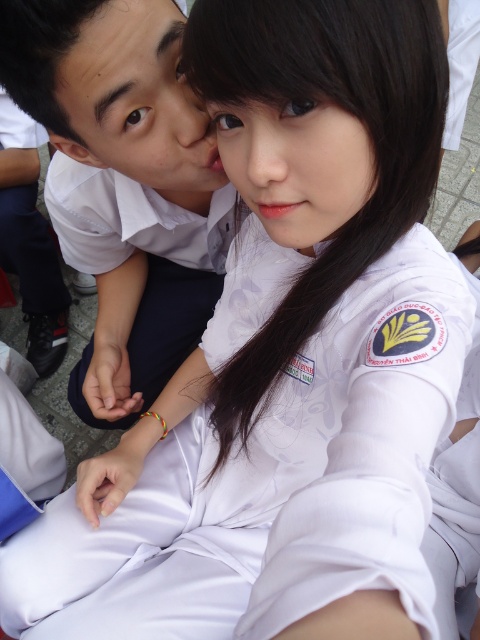
Question: Which of the following is the closest to the observer?

Choices:
 (A) white smooth shirt at upper left
 (B) smooth skin face at center
 (C) matte white face at upper left

Answer: (B)

Question: Estimate the real-world distances between objects in this image. Which object is closer to the smooth skin face at center?

Choices:
 (A) matte white face at upper left
 (B) white smooth shirt at upper left

Answer: (A)

Question: Can you confirm if white smooth shirt at upper left is positioned to the right of smooth skin face at center?

Choices:
 (A) yes
 (B) no

Answer: (B)

Question: Which object is the closest to the matte white face at upper left?

Choices:
 (A) smooth skin face at center
 (B) white smooth shirt at upper left

Answer: (B)

Question: Does white smooth shirt at upper left lie in front of smooth skin face at center?

Choices:
 (A) yes
 (B) no

Answer: (B)

Question: Can you confirm if white smooth shirt at upper left is positioned to the right of matte white face at upper left?

Choices:
 (A) no
 (B) yes

Answer: (A)